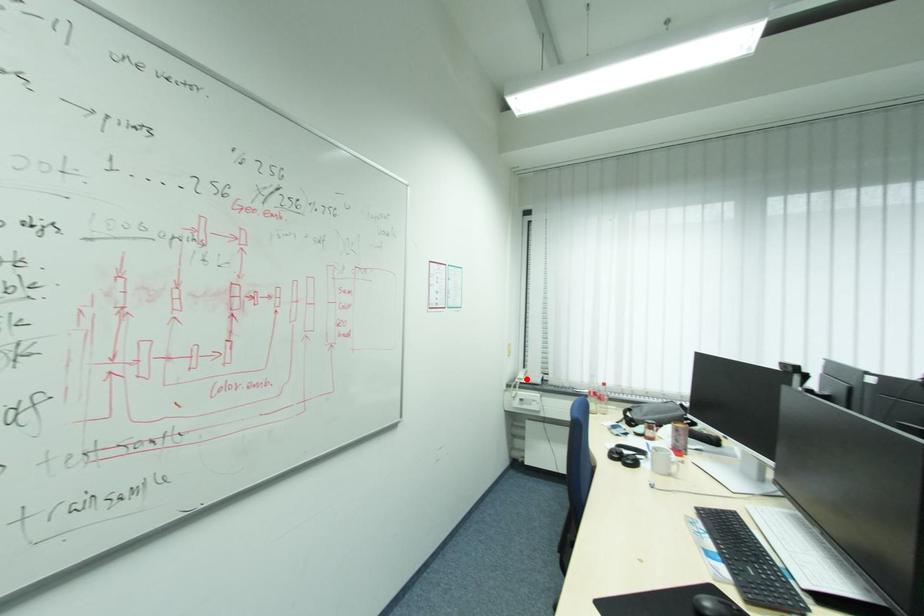
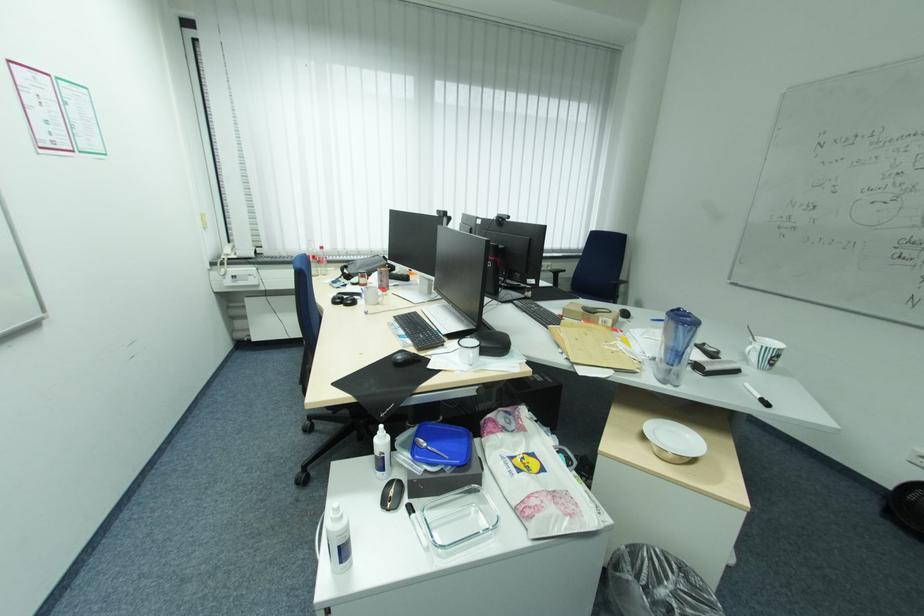
Find the pixel in the second image that matches the highlighted location in the first image.

(234, 254)